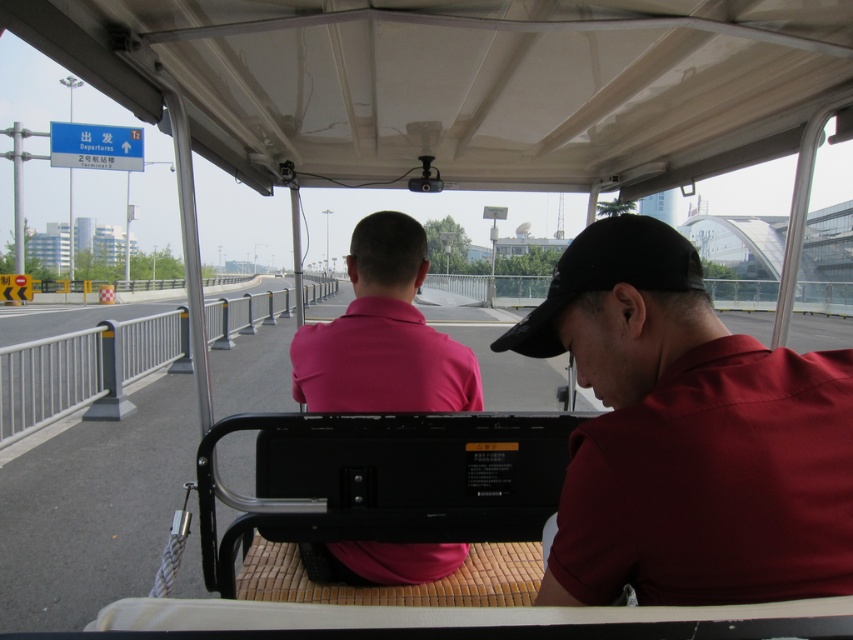
Who is lower down, matte red shirt at center or pink cotton shirt at center?

pink cotton shirt at center is lower down.

Is point (648, 417) more distant than point (350, 557)?

No, it is in front of (350, 557).

Which is in front, point (752, 413) or point (381, 292)?

Point (752, 413) is in front.

What are the coordinates of `matte red shirt at center` in the screenshot? It's located at [688, 436].